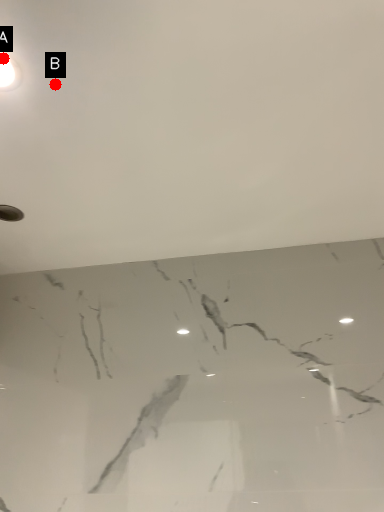
Question: Two points are circled on the image, labeled by A and B beside each circle. Which point is farther from the camera taking this photo?

Choices:
 (A) A is further
 (B) B is further

Answer: (B)